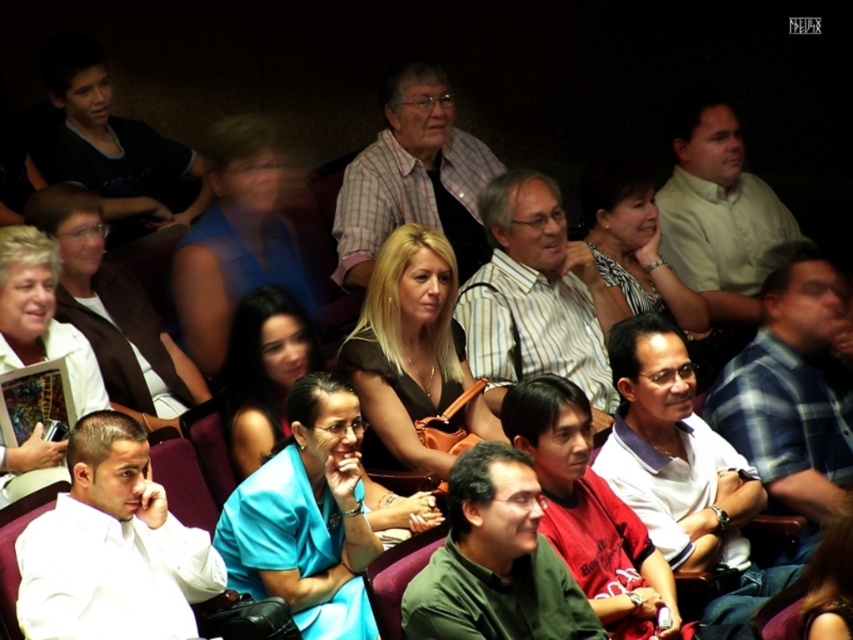
Does matte white jacket at center-left come in front of striped fabric dress at center?

Yes, matte white jacket at center-left is closer to the viewer.

The image size is (853, 640). I want to click on matte white jacket at center-left, so click(x=113, y=312).

Where is `matte white jacket at center-left`? The width and height of the screenshot is (853, 640). matte white jacket at center-left is located at coordinates (113, 312).

Locate an element on the screen. The height and width of the screenshot is (640, 853). matte white jacket at center-left is located at coordinates (113, 312).

Who is lower down, brown matte dress at center or matte white jacket at center-left?

brown matte dress at center is below.

Is brown matte dress at center taller than matte white jacket at center-left?

Yes, brown matte dress at center is taller than matte white jacket at center-left.

Where is `brown matte dress at center`? This screenshot has width=853, height=640. brown matte dress at center is located at coordinates (407, 348).

Which is more to the right, brown matte dress at center or white paper at center?

brown matte dress at center is more to the right.

This screenshot has height=640, width=853. What do you see at coordinates (407, 348) in the screenshot?
I see `brown matte dress at center` at bounding box center [407, 348].

What are the coordinates of `brown matte dress at center` in the screenshot? It's located at (407, 348).